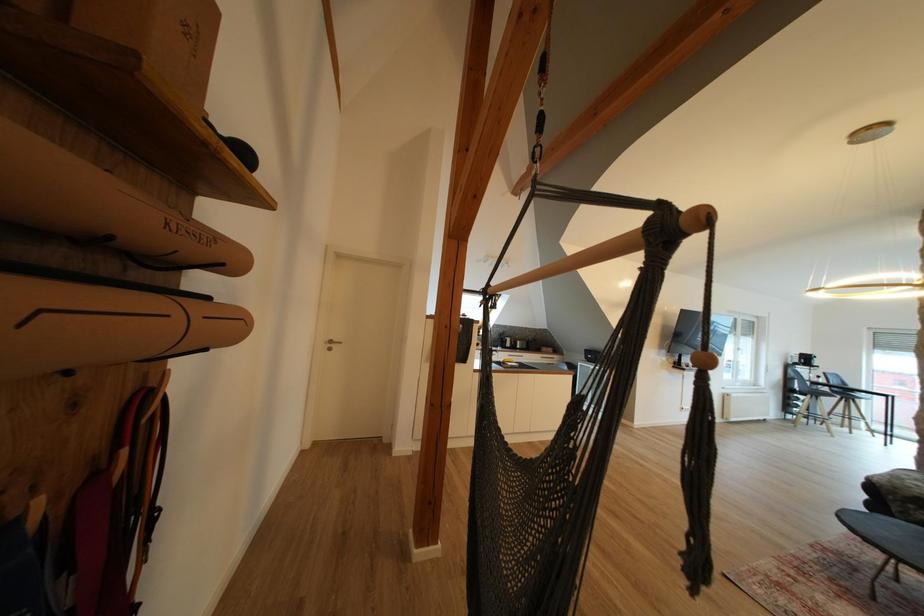
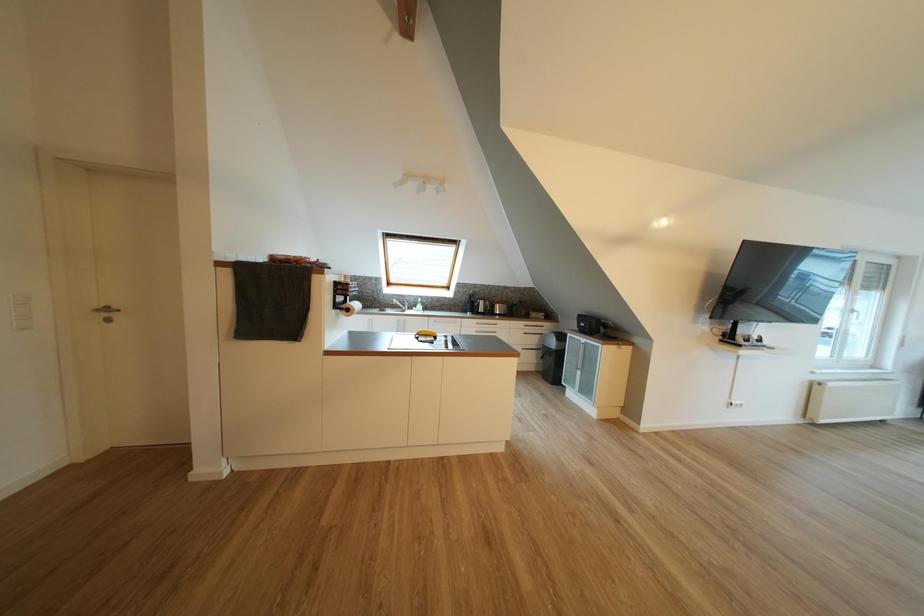
Which direction would the cameraman need to move to produce the second image?

The movement direction of the cameraman is right, forward.